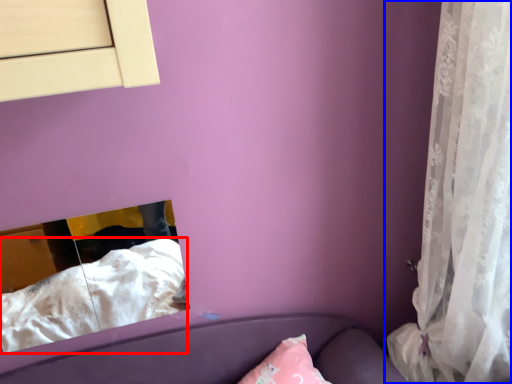
Question: Among these objects, which one is nearest to the camera, sheet (highlighted by a red box) or curtain (highlighted by a blue box)?

Choices:
 (A) sheet
 (B) curtain

Answer: (B)